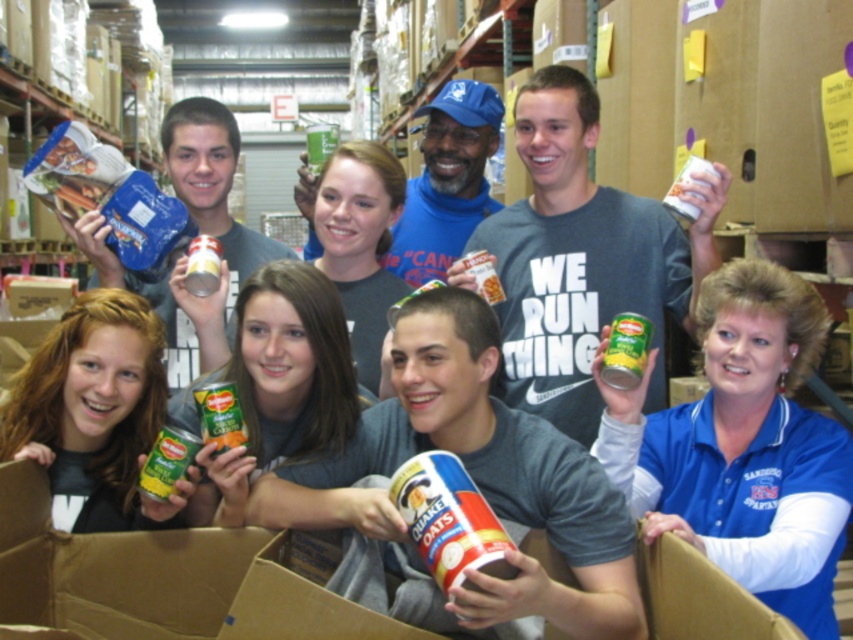
Between white paper cup at center and blue fabric shirt at lower right, which one is positioned higher?

blue fabric shirt at lower right is higher up.

Who is positioned more to the left, white paper cup at center or blue fabric shirt at lower right?

From the viewer's perspective, white paper cup at center appears more on the left side.

Which is behind, point (540, 595) or point (779, 467)?

Positioned behind is point (779, 467).

Locate an element on the screen. The height and width of the screenshot is (640, 853). white paper cup at center is located at coordinates (473, 477).

Measure the distance from green metallic can at center to green matte can at upper left.

They are 34.48 inches apart.

Does green metallic can at center lie behind green matte can at upper left?

No.

At what (x,y) coordinates should I click in order to perform the action: click on green metallic can at center. Please return your answer as a coordinate pair (x, y). The image size is (853, 640). Looking at the image, I should click on (581, 253).

Is blue fabric shirt at lower right below green metallic can at center?

Correct, blue fabric shirt at lower right is located below green metallic can at center.

Which of these two, blue fabric shirt at lower right or green metallic can at center, stands taller?

green metallic can at center

Who is more forward, (766, 452) or (659, 365)?

Point (766, 452)

I want to click on blue fabric shirt at lower right, so click(744, 445).